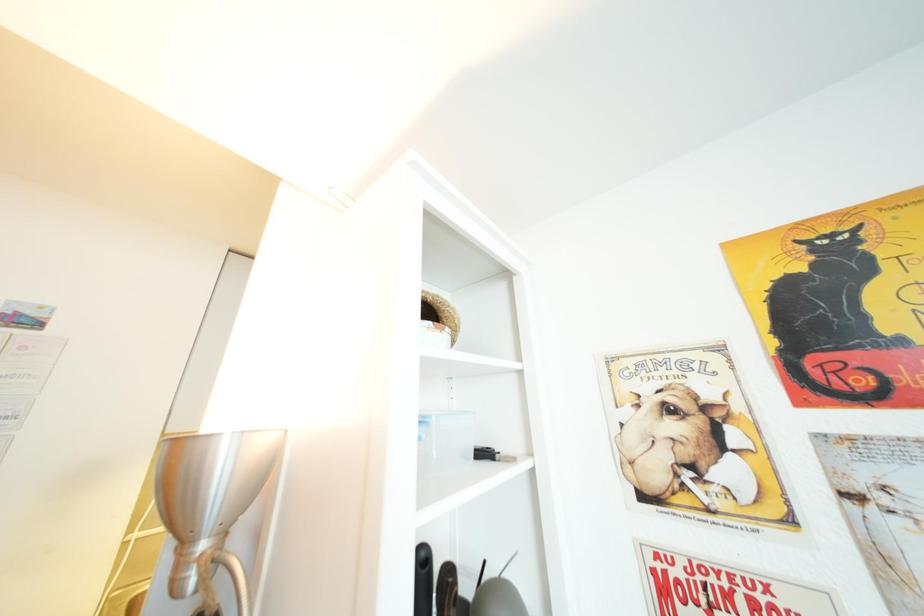
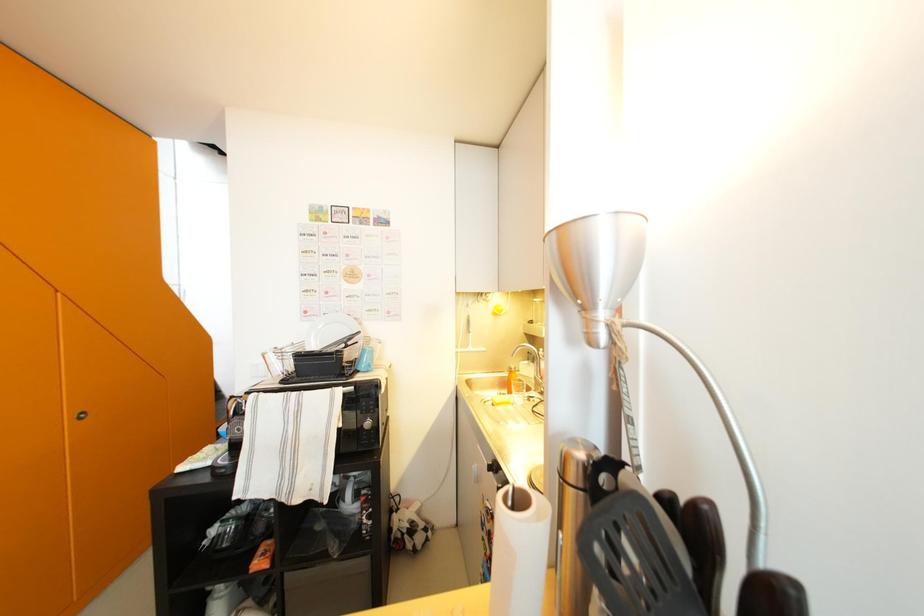
Based on the continuous images, in which direction is the camera rotating?

The camera rotated toward left-down.